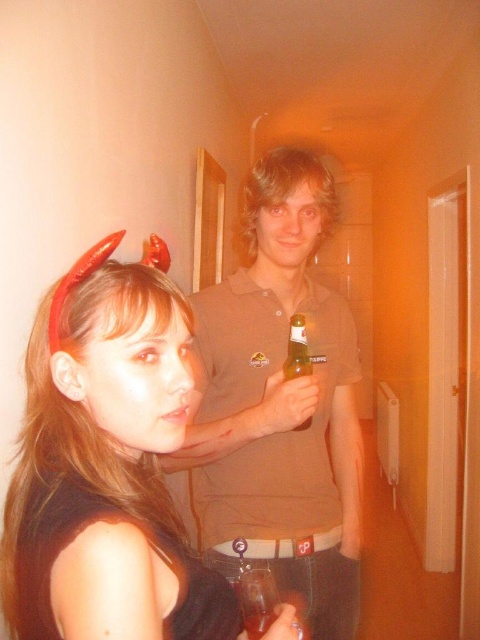
Does matte black dress at center appear over red plastic horns at upper left?

Actually, matte black dress at center is below red plastic horns at upper left.

Between matte black dress at center and red plastic horns at upper left, which one appears on the left side from the viewer's perspective?

Positioned to the left is red plastic horns at upper left.

Image resolution: width=480 pixels, height=640 pixels. Describe the element at coordinates (106, 467) in the screenshot. I see `matte black dress at center` at that location.

The image size is (480, 640). In order to click on matte black dress at center in this screenshot , I will do `click(106, 467)`.

Who is taller, matte black dress at center or brown cotton shirt at center?

Standing taller between the two is brown cotton shirt at center.

Which is behind, point (93, 282) or point (305, 257)?

The point (305, 257) is more distant.

You are a GUI agent. You are given a task and a screenshot of the screen. Output one action in this format:
    pyautogui.click(x=<x>, y=<y>)
    Task: Click on the matte black dress at center
    
    Given the screenshot: What is the action you would take?
    106,467

Looking at this image, can you confirm if brown cotton shirt at center is smaller than clear glass beer bottle at center?

Actually, brown cotton shirt at center might be larger than clear glass beer bottle at center.

Which is above, brown cotton shirt at center or clear glass beer bottle at center?

clear glass beer bottle at center

At what (x,y) coordinates should I click in order to perform the action: click on brown cotton shirt at center. Please return your answer as a coordinate pair (x, y). This screenshot has width=480, height=640. Looking at the image, I should click on (279, 403).